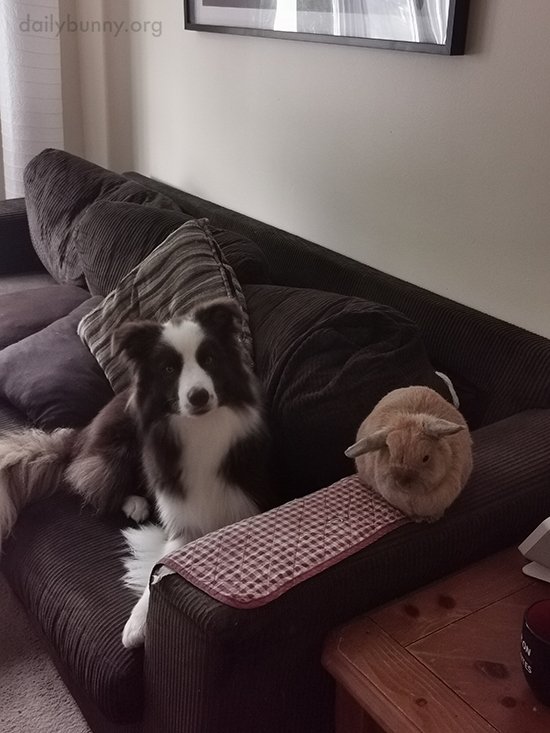
This screenshot has height=733, width=550. I want to click on mug, so click(540, 652).